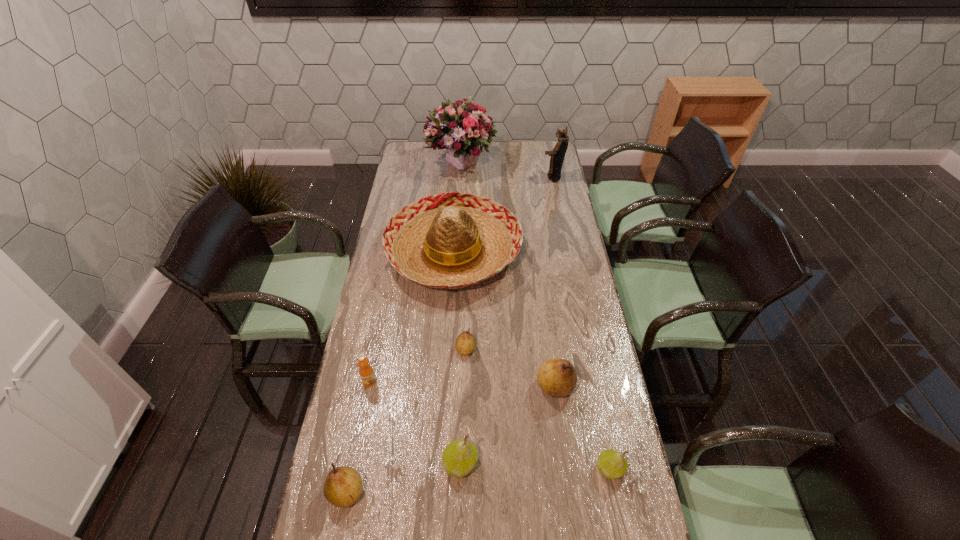
You are a GUI agent. You are given a task and a screenshot of the screen. Output one action in this format:
    pyautogui.click(x=<x>, y=<y>)
    Task: Click on the vacant space located 0.140m on the right of the bigger green pear
    The width and height of the screenshot is (960, 540).
    Given the screenshot: What is the action you would take?
    pyautogui.click(x=527, y=464)

Identify the location of blank area located 0.100m on the front label of the orange juice. This screenshot has height=540, width=960. (363, 416).

Find the location of a particular element. The image size is (960, 540). free space located on the back of the second smallest brown pear is located at coordinates (360, 427).

Identify the location of vacant space located 0.230m on the left of the rightmost pear. This screenshot has height=540, width=960. (514, 469).

Identify the location of free spot located 0.210m on the front of the shortest pear. This screenshot has width=960, height=540. (464, 417).

You are a GUI agent. You are given a task and a screenshot of the screen. Output one action in this format:
    pyautogui.click(x=<x>, y=<y>)
    Task: Click on the object that is at the far edge
    The width and height of the screenshot is (960, 540).
    Given the screenshot: What is the action you would take?
    click(460, 127)

This screenshot has height=540, width=960. What are the coordinates of `bouquet positioned at the left edge` in the screenshot? It's located at (460, 127).

Identify the location of sombrero that is positioned at the left edge. Image resolution: width=960 pixels, height=540 pixels. (452, 240).

I want to click on orange juice situated at the left edge, so point(366,372).

Identify the location of pear that is at the left edge. (343, 486).